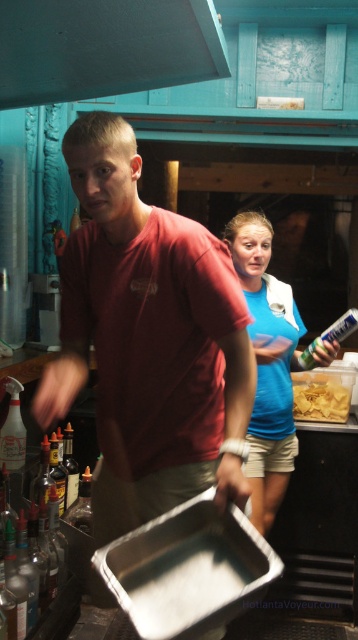
Who is lower down, matte red shirt at center or translucent glass bottle at lower left?

Positioned lower is translucent glass bottle at lower left.

Does matte red shirt at center have a lesser height compared to translucent glass bottle at lower left?

In fact, matte red shirt at center may be taller than translucent glass bottle at lower left.

Locate an element on the screen. The width and height of the screenshot is (358, 640). matte red shirt at center is located at coordinates (147, 340).

Can you confirm if yellow crispy chips at center is taller than clear glass bottle at left?

No, yellow crispy chips at center is not taller than clear glass bottle at left.

Is point (321, 410) less distant than point (12, 579)?

No, it is behind (12, 579).

Is point (325, 400) farther from camera compared to point (8, 589)?

Yes, point (325, 400) is farther from viewer.

Locate an element on the screen. This screenshot has width=358, height=640. yellow crispy chips at center is located at coordinates (321, 396).

Does point (137, 358) come in front of point (15, 51)?

Yes, it is.

Does matte red shirt at center have a lesser width compared to smooth matte black exhaust hood at upper center?

Yes, matte red shirt at center is thinner than smooth matte black exhaust hood at upper center.

This screenshot has width=358, height=640. Describe the element at coordinates (147, 340) in the screenshot. I see `matte red shirt at center` at that location.

Find the location of `matte red shirt at center`. matte red shirt at center is located at coordinates (147, 340).